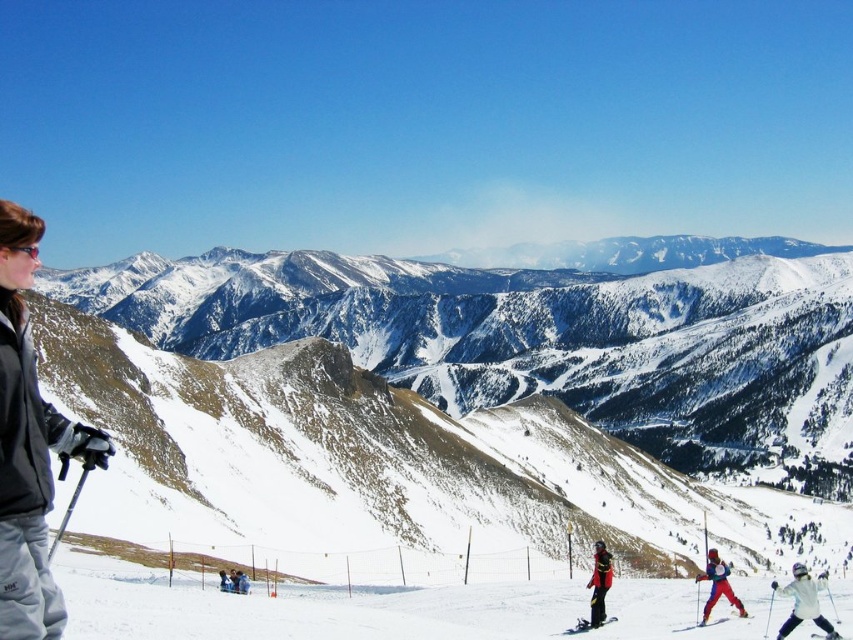
You are a photographer at the ski resort and want to capture a photo where the red ski suit at center and the matte black ski at lower center are both visible. Based on their sizes, which object will appear bigger in the photo?

The red ski suit at center will appear bigger in the photo because it is larger in size than the matte black ski at lower center.

You are a photographer trying to capture a photo of the red ski suit at center and the matte black ski at lower center. Which object should you zoom in on to make it appear larger in your photo?

The red ski suit at center is much taller than the matte black ski at lower center, so you should zoom in on the red ski suit at center to make it appear larger in your photo.